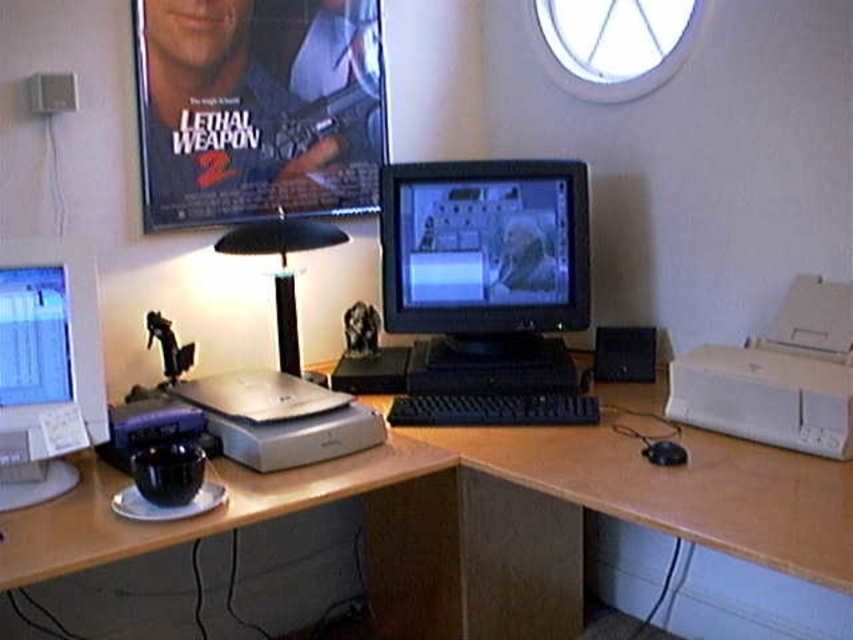
Does matte plastic poster at upper left have a greater height compared to black plastic keyboard at center?

Yes.

Is matte plastic poster at upper left wider than black plastic keyboard at center?

Yes.

The height and width of the screenshot is (640, 853). What do you see at coordinates (256, 108) in the screenshot?
I see `matte plastic poster at upper left` at bounding box center [256, 108].

In order to click on matte plastic poster at upper left in this screenshot , I will do `click(256, 108)`.

Can you confirm if matte black monitor at center is smaller than white glossy monitor at left?

No.

Does point (421, 376) lie in front of point (27, 502)?

That is False.

Find the location of a particular element. matte black monitor at center is located at coordinates (486, 269).

Does matte black monitor at center appear under black plastic mouse at lower right?

Actually, matte black monitor at center is above black plastic mouse at lower right.

Does matte black monitor at center have a lesser height compared to black plastic mouse at lower right?

In fact, matte black monitor at center may be taller than black plastic mouse at lower right.

Find the location of a particular element. Image resolution: width=853 pixels, height=640 pixels. matte black monitor at center is located at coordinates (486, 269).